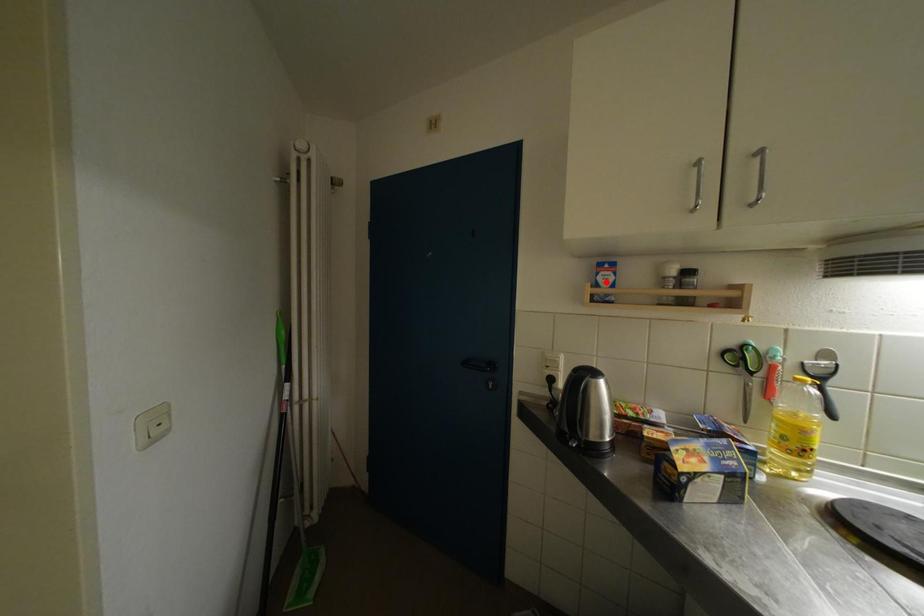
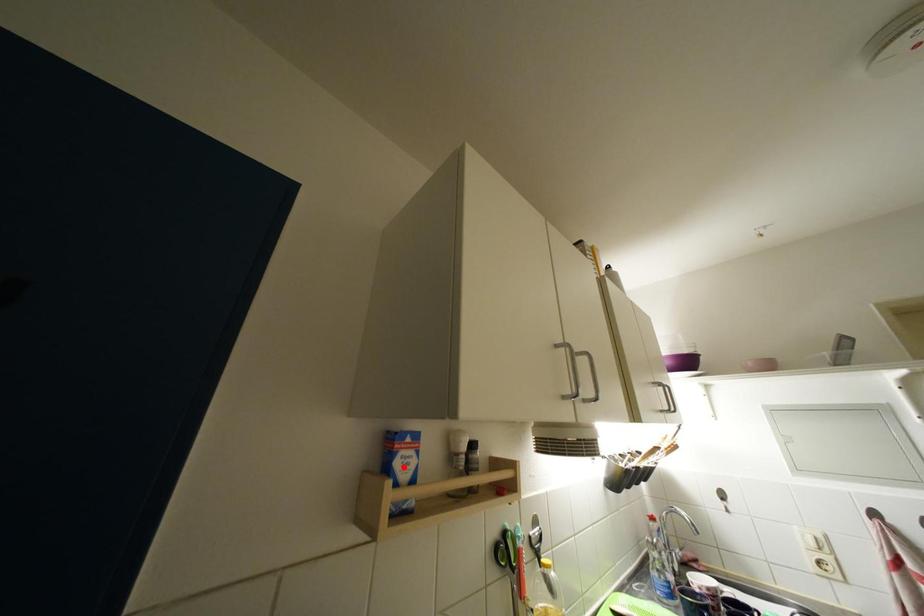
I am providing you with two images of the same scene from different viewpoints. A red point is marked on the first image and another point is marked on the second image. Are the points marked in image1 and image2 representing the same 3D position?

Yes